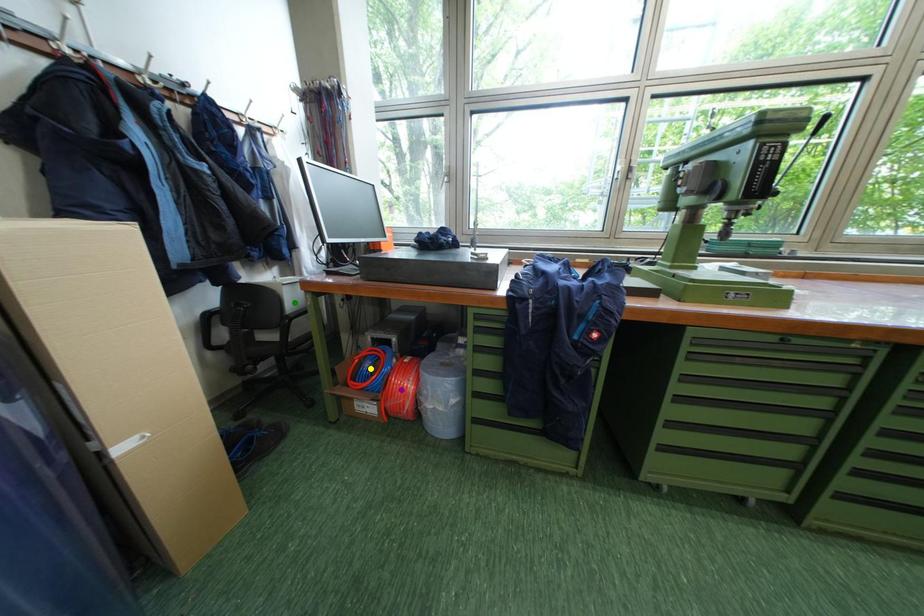
Order these from nearest to farthest:
purple point, yellow point, green point

yellow point
purple point
green point